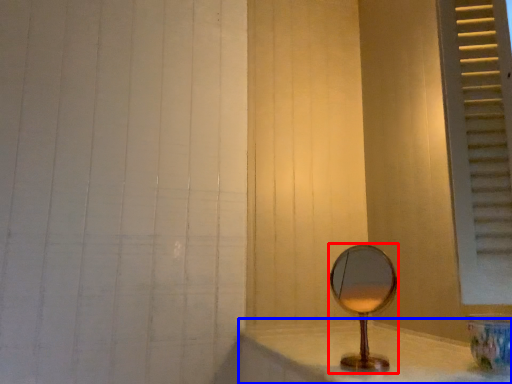
Question: Which object appears closest to the camera in this image, mirror (highlighted by a red box) or counter top (highlighted by a blue box)?

Choices:
 (A) mirror
 (B) counter top

Answer: (B)